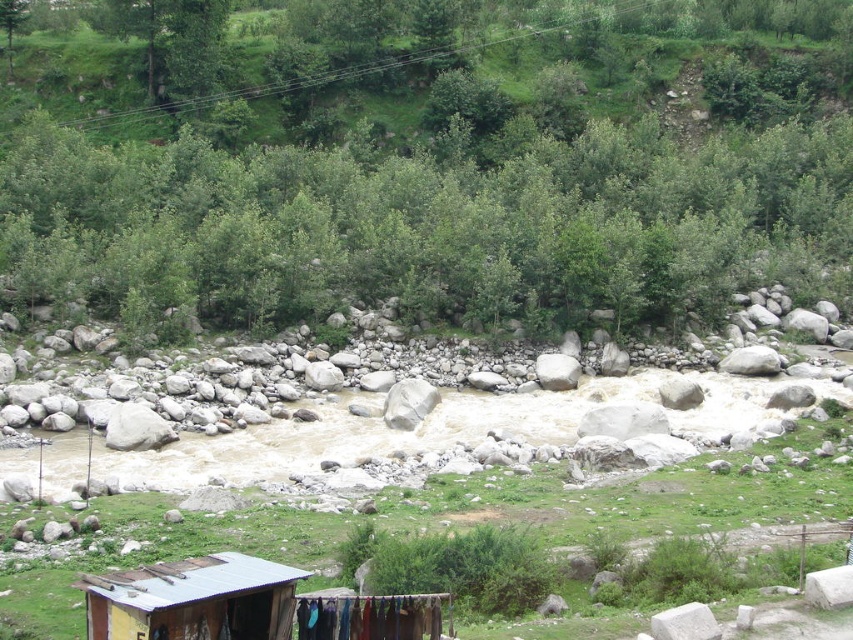
You are planning to build a small garden between the green grass at center and the rusty metal hut at lower left. If the garden requires a minimum of 40 feet of space between the two points, will there be enough space?

The distance between the green grass at center and the rusty metal hut at lower left is 39.25 feet, which is less than the required 40 feet. Therefore, there is not enough space for the garden.

You are a hiker trying to determine which object in the scene is bigger between the green leafy tree at upper center and the green grass at center. Based on the scene, which one is larger?

The green leafy tree at upper center is larger than the green grass at center.

You are standing at the edge of the river and see the green leafy tree at upper center and the green grass at center. Which object is higher up in the image?

The green leafy tree at upper center is positioned over green grass at center, so it is higher up in the image.